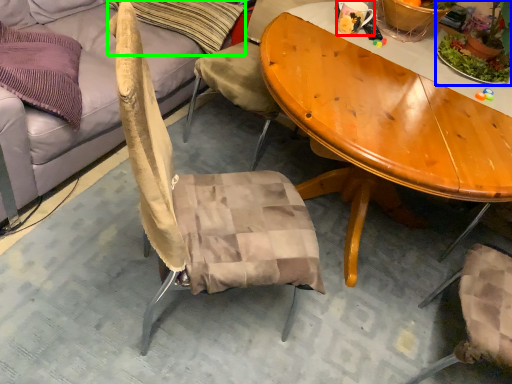
Question: Which is nearer to the coffee cup (highlighted by a red box)? houseplant (highlighted by a blue box) or pillow (highlighted by a green box).

Choices:
 (A) houseplant
 (B) pillow

Answer: (A)